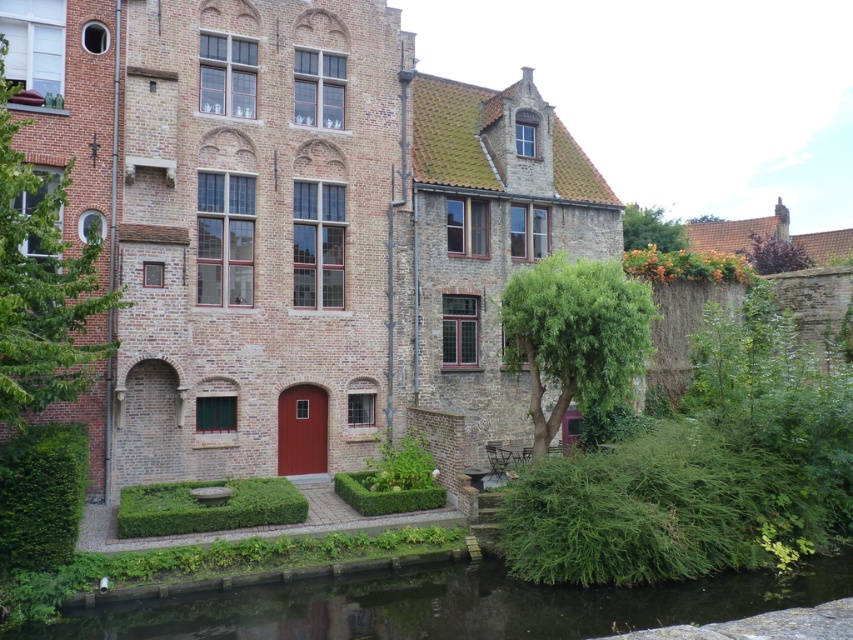
You are a tourist standing in front of the traditional European building by the canal. You notice the green grassy river at bottom and the green leafy tree at upper left. Which of these two objects is wider?

The green grassy river at bottom is wider than the green leafy tree at upper left.

You are a drone operator who needs to fly a drone between the two green leafy trees. The drone has a maximum flight range of 25 meters. Based on the scene, can the drone safely fly between the green leafy tree at upper left and the green leafy tree at upper right without exceeding its range?

The distance between the green leafy tree at upper left and the green leafy tree at upper right is 30.29 meters. Since the drone has a maximum flight range of 25 meters, it cannot safely fly between them without exceeding its range.